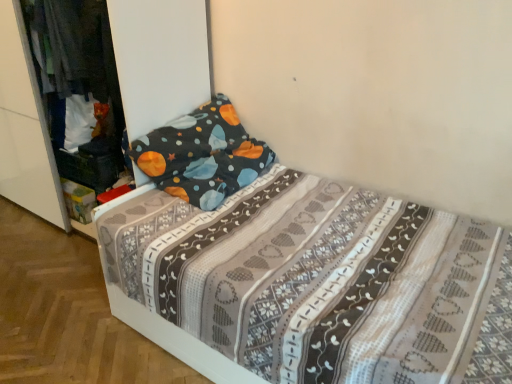
Question: Is patterned fabric bed at center at the right side of dark blue fabric at left?

Choices:
 (A) yes
 (B) no

Answer: (A)

Question: From the image's perspective, is patterned fabric bed at center located beneath dark blue fabric at left?

Choices:
 (A) yes
 (B) no

Answer: (A)

Question: Does patterned fabric bed at center contain dark blue fabric at left?

Choices:
 (A) yes
 (B) no

Answer: (B)

Question: Is patterned fabric bed at center to the left of dark blue fabric at left from the viewer's perspective?

Choices:
 (A) yes
 (B) no

Answer: (B)

Question: Does patterned fabric bed at center have a greater width compared to dark blue fabric at left?

Choices:
 (A) no
 (B) yes

Answer: (B)

Question: Does patterned fabric bed at center have a greater height compared to dark blue fabric at left?

Choices:
 (A) no
 (B) yes

Answer: (B)

Question: Considering the relative sizes of dark blue fabric at left and white fabric bed at center in the image provided, is dark blue fabric at left shorter than white fabric bed at center?

Choices:
 (A) no
 (B) yes

Answer: (B)

Question: Considering the relative sizes of dark blue fabric at left and white fabric bed at center in the image provided, is dark blue fabric at left thinner than white fabric bed at center?

Choices:
 (A) yes
 (B) no

Answer: (A)

Question: Is dark blue fabric at left not near white fabric bed at center?

Choices:
 (A) no
 (B) yes

Answer: (A)

Question: Is dark blue fabric at left positioned behind white fabric bed at center?

Choices:
 (A) no
 (B) yes

Answer: (B)

Question: Does dark blue fabric at left turn towards white fabric bed at center?

Choices:
 (A) yes
 (B) no

Answer: (A)

Question: Is dark blue fabric at left beside white fabric bed at center?

Choices:
 (A) yes
 (B) no

Answer: (B)

Question: Are dark blue fabric at left and patterned fabric bed at center making contact?

Choices:
 (A) yes
 (B) no

Answer: (B)